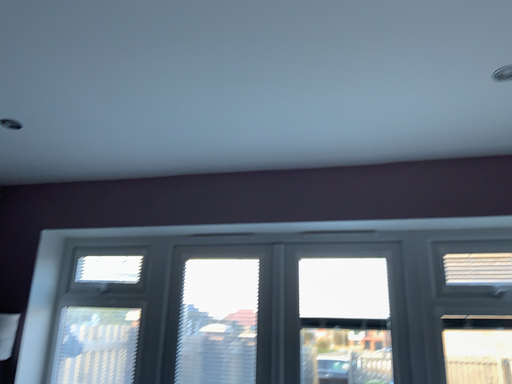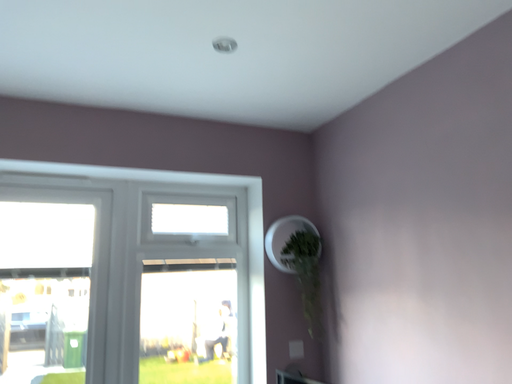
Question: Which way did the camera rotate in the video?

Choices:
 (A) rotated downward
 (B) rotated upward

Answer: (A)